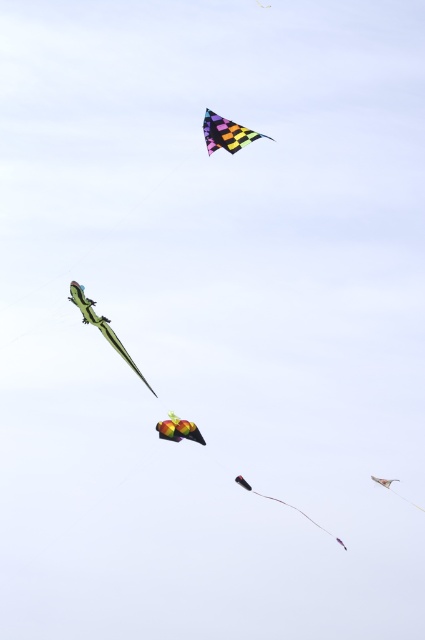
Consider the image. Where is the multicolored checkered kite at upper center located in the image?

The multicolored checkered kite at upper center is located at point (226, 132).

You are standing on the ground looking up at the sky with the black matte kite at center and the shiny silver kite at lower right. Which kite appears larger to you?

The black matte kite at center appears larger because it is closer to the viewer than the shiny silver kite at lower right.